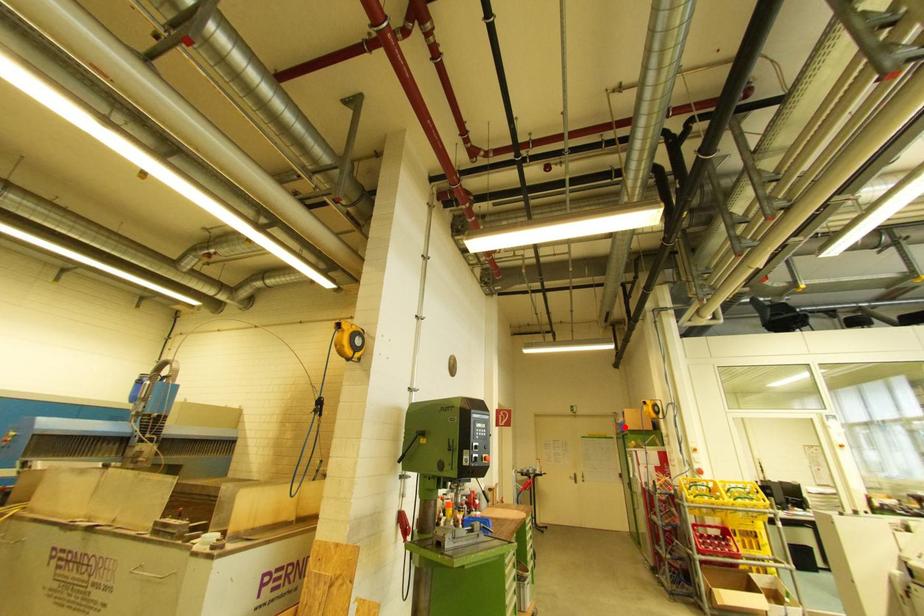
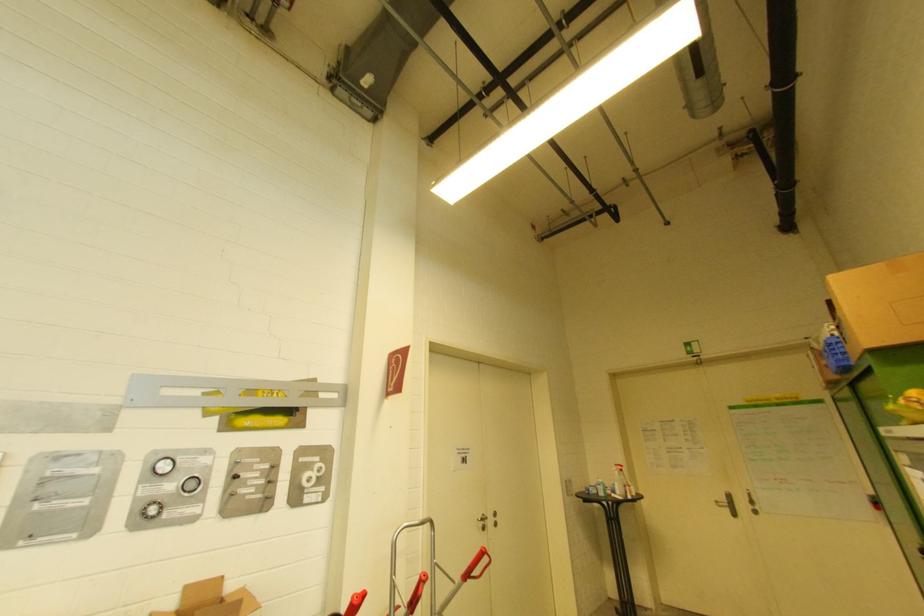
Where in the second image is the point corresponding to the highlighted location from the first image?

(839, 345)